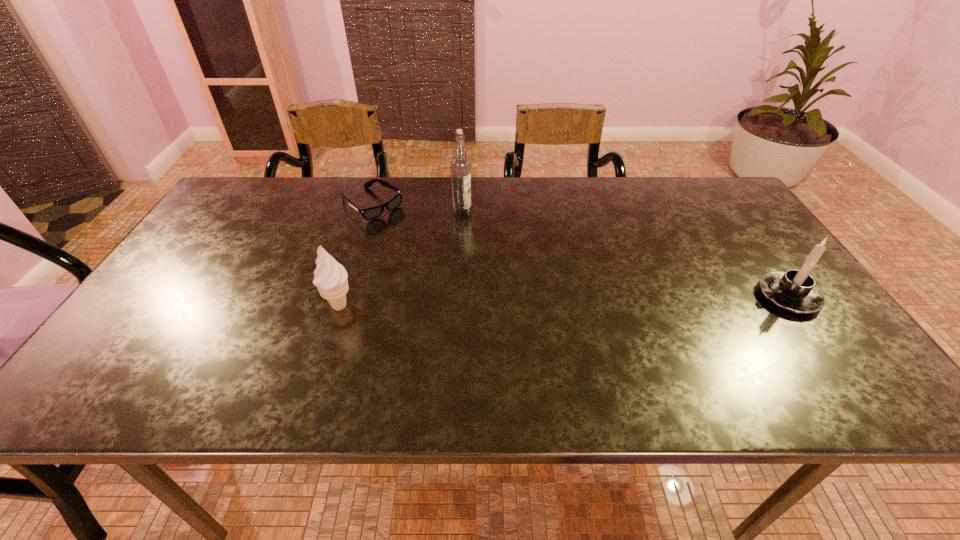
You are a GUI agent. You are given a task and a screenshot of the screen. Output one action in this format:
    pyautogui.click(x=<x>, y=<y>)
    Task: Click on the free space on the desktop that is between the icecream and the candle holder and is positioned on the front-facing side of the shortest object
    This screenshot has width=960, height=540.
    Given the screenshot: What is the action you would take?
    pyautogui.click(x=507, y=302)

This screenshot has width=960, height=540. I want to click on free spot on the desktop that is between the icecream and the rightmost object and is positioned on the label of the tallest object, so click(564, 301).